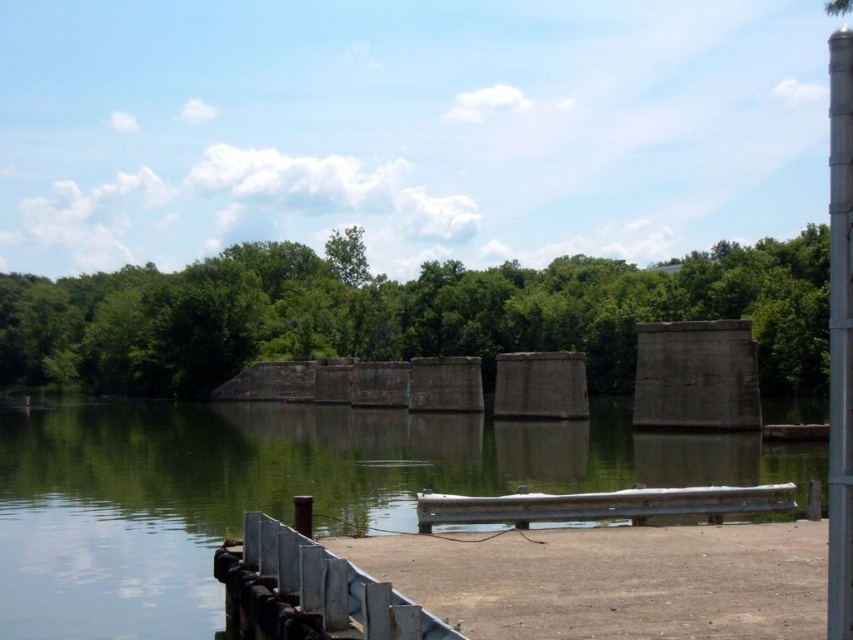
Question: Which object is closer to the camera taking this photo?

Choices:
 (A) green leafy trees at center
 (B) green concrete river at center
 (C) metallic gray park bench at lower center

Answer: (B)

Question: Which point is farther to the camera?

Choices:
 (A) (730, 438)
 (B) (625, 380)
 (C) (708, 484)

Answer: (B)

Question: Where is green concrete river at center located in relation to green leafy trees at center in the image?

Choices:
 (A) right
 (B) left

Answer: (B)

Question: Can you confirm if green concrete river at center is wider than green leafy trees at center?

Choices:
 (A) no
 (B) yes

Answer: (A)

Question: Does green concrete river at center have a larger size compared to green leafy trees at center?

Choices:
 (A) no
 (B) yes

Answer: (A)

Question: Which point is closer to the camera taking this photo?

Choices:
 (A) (71, 525)
 (B) (57, 316)
 (C) (524, 497)

Answer: (C)